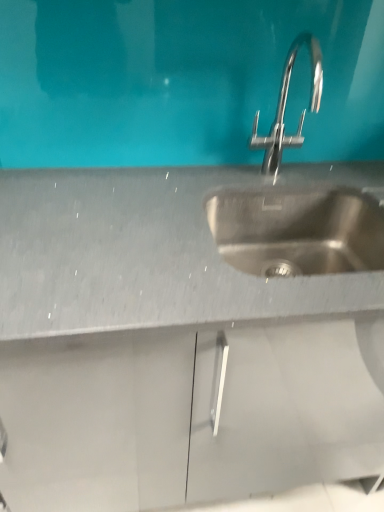
Question: In terms of height, does satin nickel faucet at upper center, which ranks as the 2th sink in bottom-to-top order, look taller or shorter compared to stainless steel sink at center, the 2th sink viewed from the top?

Choices:
 (A) tall
 (B) short

Answer: (A)

Question: From a real-world perspective, is satin nickel faucet at upper center, the 1th sink viewed from the top, above or below stainless steel sink at center, arranged as the first sink when ordered from the bottom?

Choices:
 (A) below
 (B) above

Answer: (B)

Question: In the image, is satin nickel faucet at upper center, which ranks as the 2th sink in bottom-to-top order, positioned in front of or behind stainless steel sink at center, the 2th sink viewed from the top?

Choices:
 (A) front
 (B) behind

Answer: (A)

Question: Is stainless steel sink at center, arranged as the first sink when ordered from the bottom, spatially inside satin nickel faucet at upper center, the 1th sink viewed from the top, or outside of it?

Choices:
 (A) inside
 (B) outside

Answer: (B)

Question: Relative to satin nickel faucet at upper center, the 1th sink viewed from the top, is stainless steel sink at center, the 2th sink viewed from the top, in front or behind?

Choices:
 (A) front
 (B) behind

Answer: (B)

Question: Considering the positions of stainless steel sink at center, arranged as the first sink when ordered from the bottom, and satin nickel faucet at upper center, the 1th sink viewed from the top, in the image, is stainless steel sink at center, arranged as the first sink when ordered from the bottom, wider or thinner than satin nickel faucet at upper center, the 1th sink viewed from the top,?

Choices:
 (A) wide
 (B) thin

Answer: (A)

Question: From their relative heights in the image, would you say stainless steel sink at center, arranged as the first sink when ordered from the bottom, is taller or shorter than satin nickel faucet at upper center, the 1th sink viewed from the top?

Choices:
 (A) tall
 (B) short

Answer: (B)